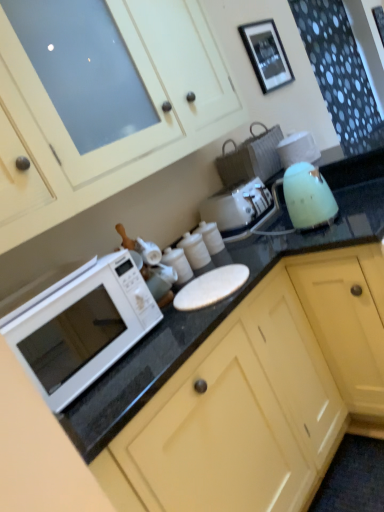
Question: Is matte white cabinet at upper center, the 1th cabinetry from the top, smaller than black matte picture frame at upper center?

Choices:
 (A) no
 (B) yes

Answer: (A)

Question: Is matte white cabinet at upper center, the 2th cabinetry positioned from the bottom, shorter than black matte picture frame at upper center?

Choices:
 (A) yes
 (B) no

Answer: (B)

Question: From the image's perspective, is matte white cabinet at upper center, the 2th cabinetry positioned from the bottom, located beneath black matte picture frame at upper center?

Choices:
 (A) no
 (B) yes

Answer: (B)

Question: Can we say matte white cabinet at upper center, the 2th cabinetry positioned from the bottom, lies outside black matte picture frame at upper center?

Choices:
 (A) yes
 (B) no

Answer: (A)

Question: Is the depth of matte white cabinet at upper center, the 1th cabinetry from the top, greater than that of black matte picture frame at upper center?

Choices:
 (A) no
 (B) yes

Answer: (A)

Question: Is black matte picture frame at upper center to the left or to the right of matte white cabinet at upper center, the 1th cabinetry from the top, in the image?

Choices:
 (A) right
 (B) left

Answer: (A)

Question: From the image's perspective, is black matte picture frame at upper center above or below matte white cabinet at upper center, the 2th cabinetry positioned from the bottom?

Choices:
 (A) above
 (B) below

Answer: (A)

Question: Is black matte picture frame at upper center taller or shorter than matte white cabinet at upper center, the 2th cabinetry positioned from the bottom?

Choices:
 (A) short
 (B) tall

Answer: (A)

Question: Considering the positions of point (264, 22) and point (62, 198), is point (264, 22) closer or farther from the camera than point (62, 198)?

Choices:
 (A) farther
 (B) closer

Answer: (A)

Question: From a real-world perspective, is matte yellow cabinet at lower center, the second cabinetry positioned from the top, physically located above or below black matte picture frame at upper center?

Choices:
 (A) below
 (B) above

Answer: (A)

Question: In terms of height, does matte yellow cabinet at lower center, the second cabinetry positioned from the top, look taller or shorter compared to black matte picture frame at upper center?

Choices:
 (A) tall
 (B) short

Answer: (A)

Question: In terms of width, does matte yellow cabinet at lower center, which is the first cabinetry from bottom to top, look wider or thinner when compared to black matte picture frame at upper center?

Choices:
 (A) wide
 (B) thin

Answer: (A)

Question: From the image's perspective, is matte yellow cabinet at lower center, which is the first cabinetry from bottom to top, above or below black matte picture frame at upper center?

Choices:
 (A) above
 (B) below

Answer: (B)

Question: In terms of height, does white glossy microwave at left look taller or shorter compared to matte yellow cabinet at lower center, which is the first cabinetry from bottom to top?

Choices:
 (A) short
 (B) tall

Answer: (A)

Question: Is point (43, 354) closer or farther from the camera than point (155, 454)?

Choices:
 (A) farther
 (B) closer

Answer: (A)